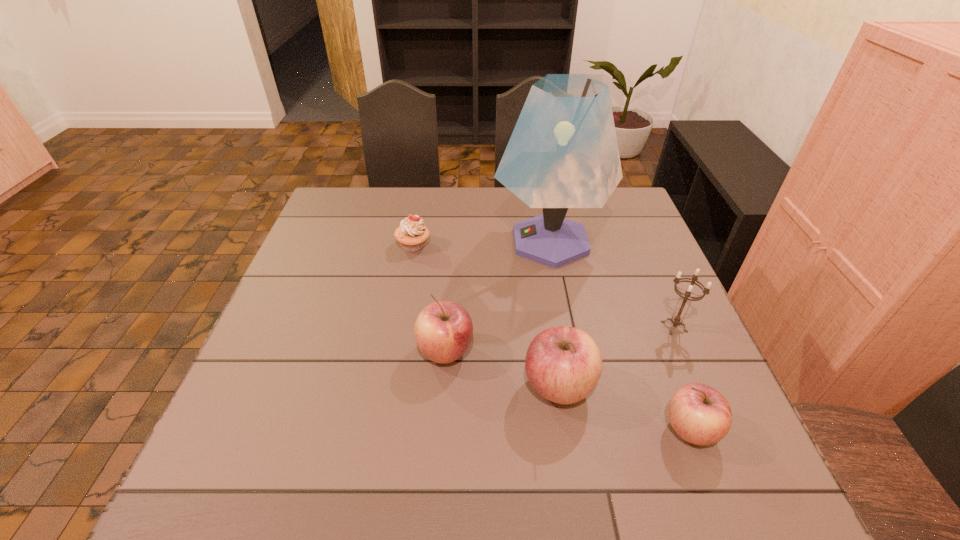
Locate an element on the screen. The height and width of the screenshot is (540, 960). vacant space that satisfies the following two spatial constraints: 1. on the base of the candle holder; 2. on the right side of the lampshade is located at coordinates (566, 327).

Find the location of a particular element. Image resolution: width=960 pixels, height=540 pixels. vacant region that satisfies the following two spatial constraints: 1. on the back side of the rightmost apple; 2. on the base of the tallest object is located at coordinates (618, 241).

Where is `free spot that satisfies the following two spatial constraints: 1. on the front side of the cupcake; 2. on the right side of the leftmost apple`? free spot that satisfies the following two spatial constraints: 1. on the front side of the cupcake; 2. on the right side of the leftmost apple is located at coordinates (394, 352).

Locate an element on the screen. The image size is (960, 540). vacant space that satisfies the following two spatial constraints: 1. on the base of the lampshade; 2. on the back side of the rightmost apple is located at coordinates (587, 429).

Where is `free space that satisfies the following two spatial constraints: 1. on the base of the shortest apple; 2. on the left side of the lampshade`? free space that satisfies the following two spatial constraints: 1. on the base of the shortest apple; 2. on the left side of the lampshade is located at coordinates (587, 429).

Image resolution: width=960 pixels, height=540 pixels. I want to click on blank space that satisfies the following two spatial constraints: 1. on the base of the rightmost apple; 2. on the left side of the tallest object, so click(x=587, y=429).